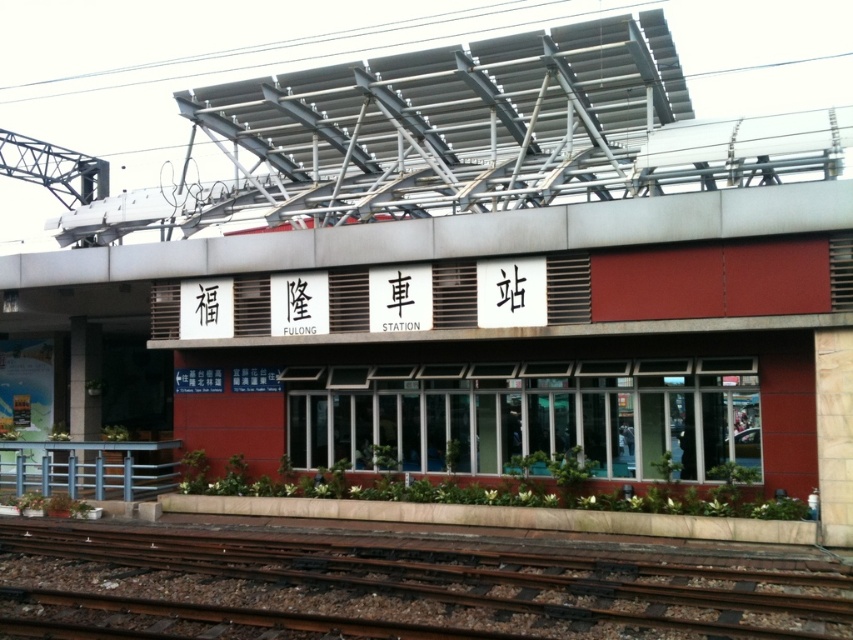
Does rusty metal train track at bottom appear over blue painted metal railing at lower left?

No, rusty metal train track at bottom is not above blue painted metal railing at lower left.

Can you confirm if rusty metal train track at bottom is positioned to the left of blue painted metal railing at lower left?

Incorrect, rusty metal train track at bottom is not on the left side of blue painted metal railing at lower left.

Where is `rusty metal train track at bottom`? This screenshot has height=640, width=853. rusty metal train track at bottom is located at coordinates (476, 577).

Locate an element on the screen. rusty metal train track at bottom is located at coordinates (476, 577).